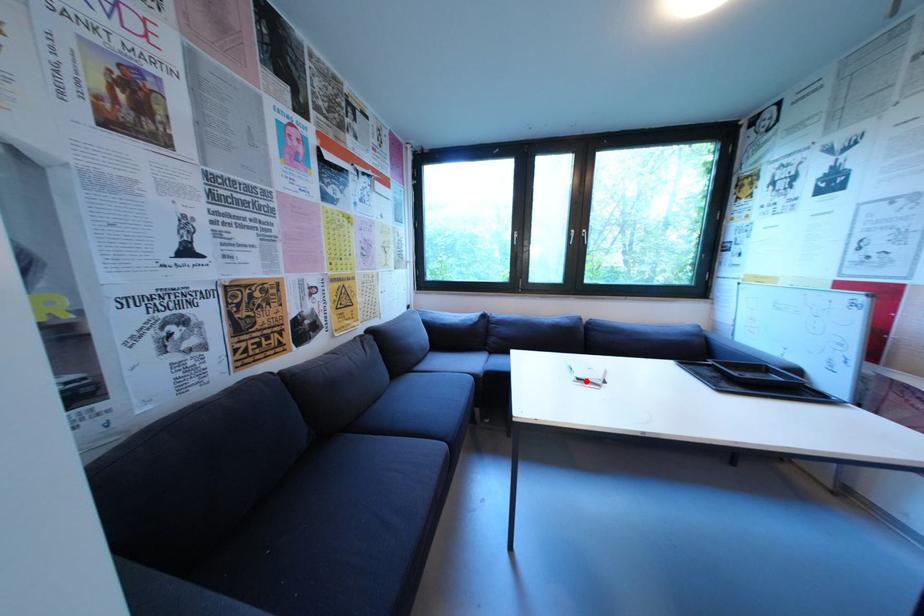
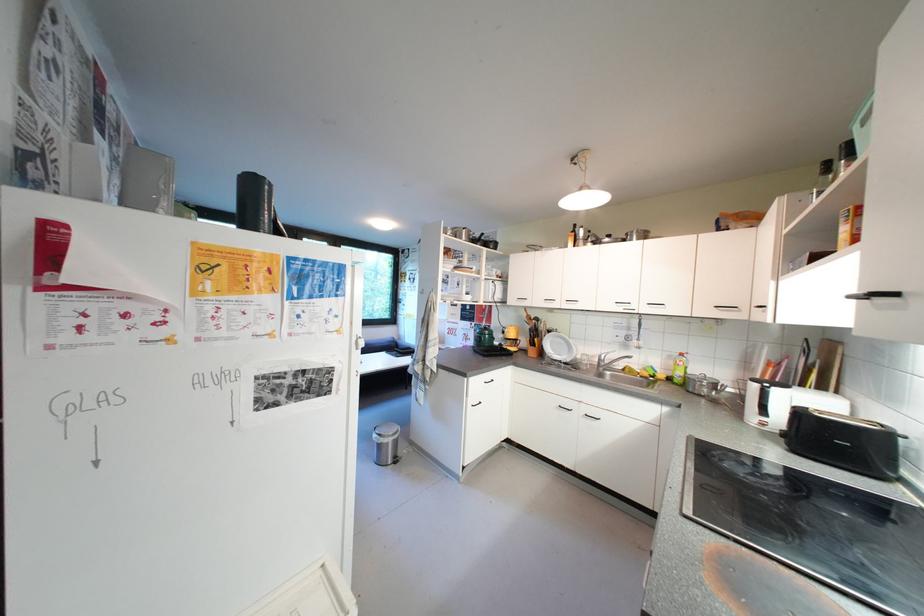
Question: I am providing you with two images of the same scene from different viewpoints. A red point is marked on the first image. At the location where the point appears in image 1, is it still visible in image 2?

Choices:
 (A) Yes
 (B) No

Answer: (B)